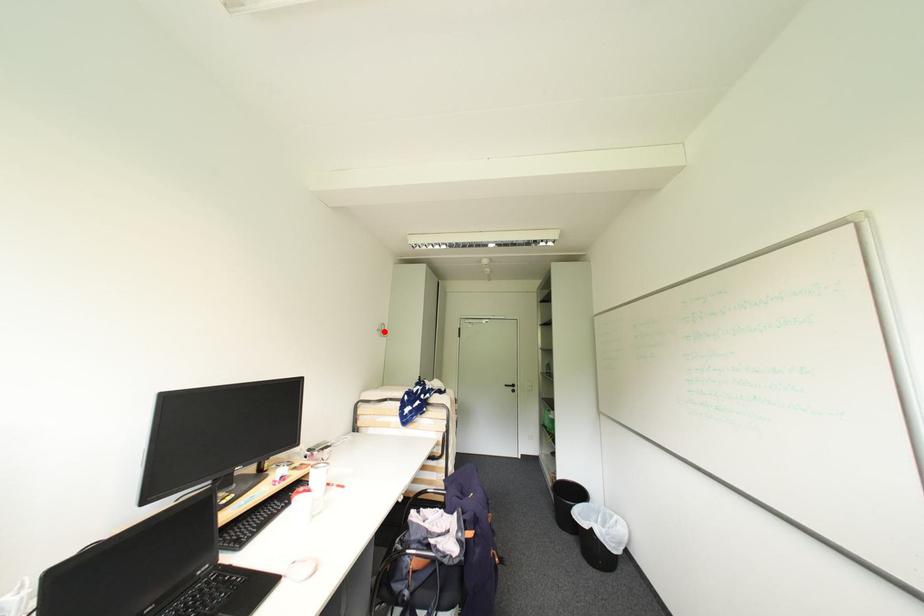
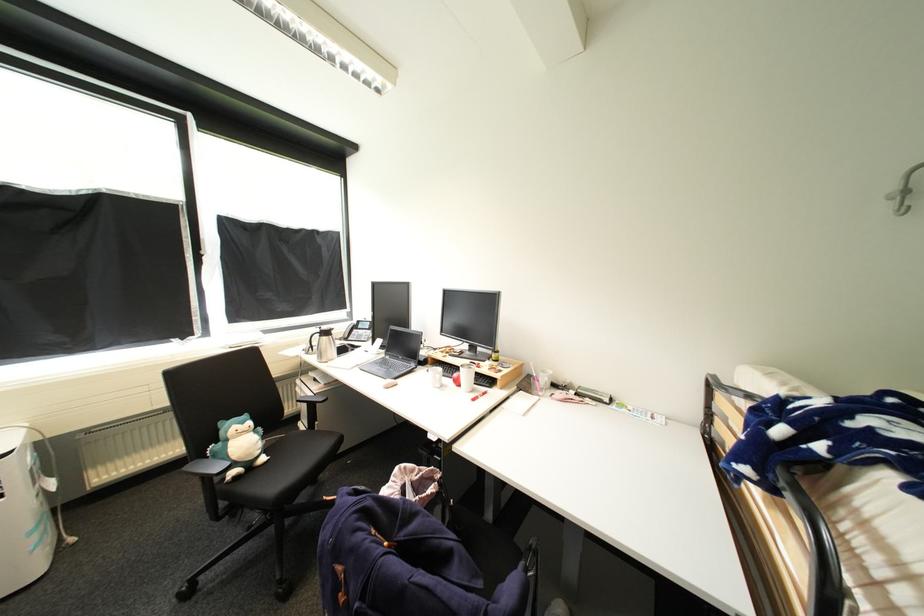
Question: I am providing you with two images of the same scene from different viewpoints. A red point is marked on the first image. Is the red point's position out of view in image 2?

Choices:
 (A) Yes
 (B) No

Answer: (B)